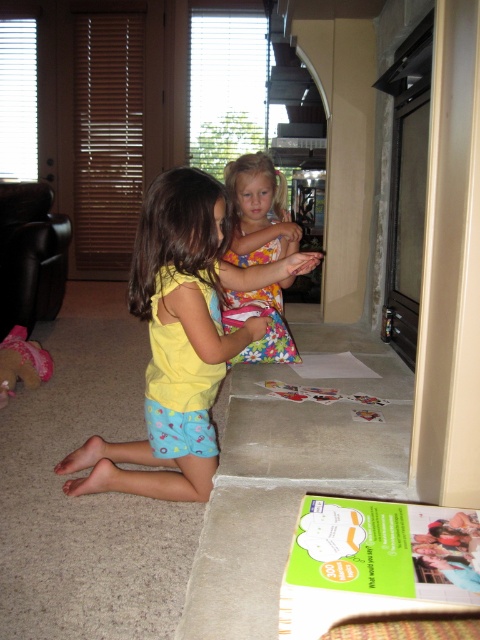
Question: Does yellow fabric shirt at center have a lesser width compared to pink fabric toy at lower left?

Choices:
 (A) no
 (B) yes

Answer: (A)

Question: Which object appears closest to the camera in this image?

Choices:
 (A) pink fabric toy at lower left
 (B) yellow fabric shirt at center

Answer: (B)

Question: Among these points, which one is farthest from the camera?

Choices:
 (A) (8, 356)
 (B) (154, 484)

Answer: (A)

Question: Can you confirm if yellow fabric shirt at center is wider than pink fabric toy at lower left?

Choices:
 (A) yes
 (B) no

Answer: (A)

Question: Is yellow fabric shirt at center to the right of pink fabric toy at lower left from the viewer's perspective?

Choices:
 (A) yes
 (B) no

Answer: (A)